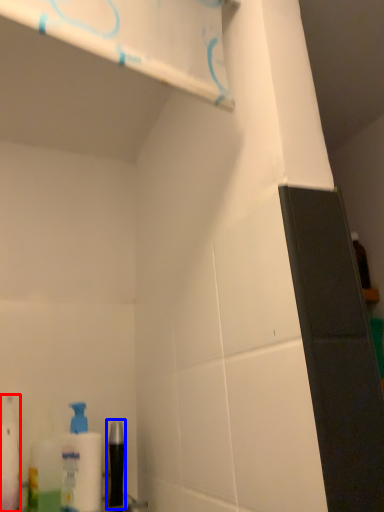
Question: Which object is further to the camera taking this photo, toiletry (highlighted by a red box) or mouthwash (highlighted by a blue box)?

Choices:
 (A) toiletry
 (B) mouthwash

Answer: (B)